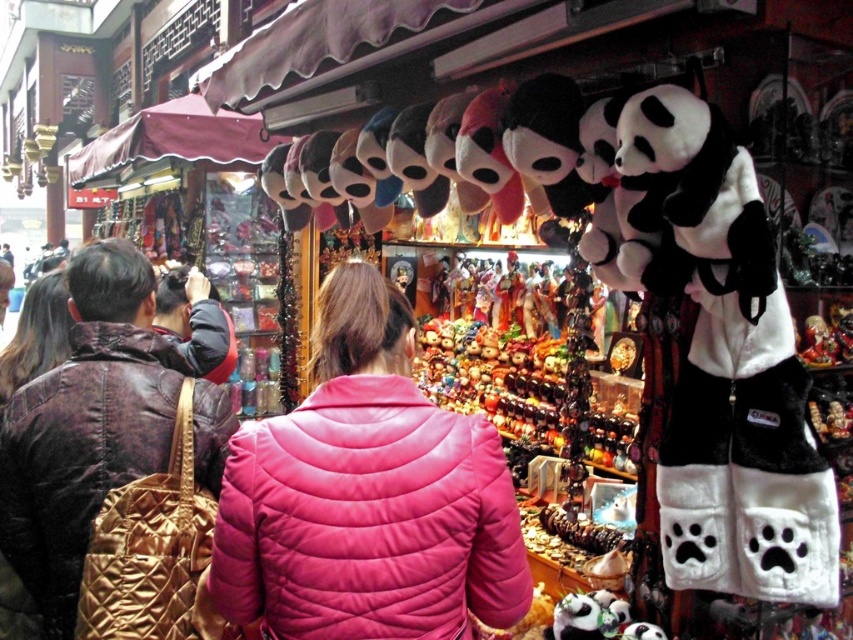
You are a customer at the market and want to hang a jacket on a hook that can only hold items up to 30 cm in height. Which jacket between the pink quilted jacket at center and the matte brown leather jacket at left would you choose to avoid overloading the hook?

The pink quilted jacket at center is much taller than the matte brown leather jacket at left, so you should choose the matte brown leather jacket at left to avoid overloading the hook since it is shorter and within the 30 cm height limit.